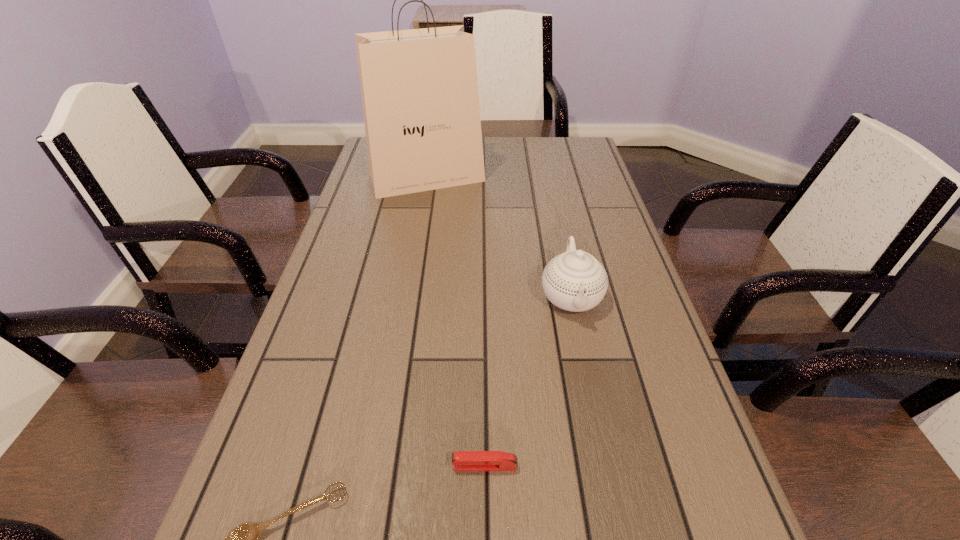
Where is `unoccupied area between the chinaware and the third tallest object`? This screenshot has height=540, width=960. unoccupied area between the chinaware and the third tallest object is located at coordinates (528, 381).

I want to click on vacant area that lies between the rightmost object and the stapler, so click(x=528, y=381).

The width and height of the screenshot is (960, 540). I want to click on free point between the second nearest object and the shopping bag, so click(456, 322).

Identify which object is the third closest to the stapler. Please provide its 2D coordinates. Your answer should be formatted as a tuple, i.e. [(x, y)], where the tuple contains the x and y coordinates of a point satisfying the conditions above.

[(419, 88)]

Where is `the second closest object to the stapler`? The width and height of the screenshot is (960, 540). the second closest object to the stapler is located at coordinates (575, 281).

Locate an element on the screen. The height and width of the screenshot is (540, 960). vacant point that satisfies the following two spatial constraints: 1. on the spout of the rightmost object; 2. on the front-facing side of the second shortest object is located at coordinates (607, 466).